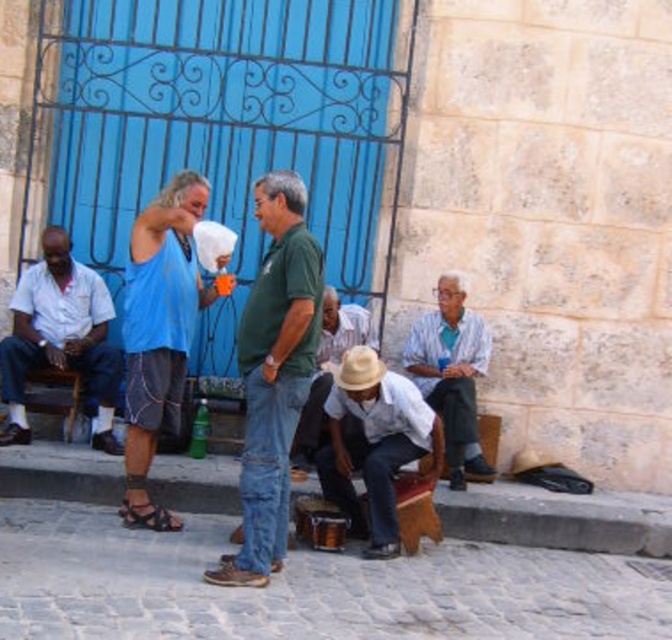
You are a photographer trying to capture a photo of the green matte shirt at center and the brown leather sandal at lower left. Since you want both subjects to be in focus, which one should you focus on first to ensure the other is also in focus?

The green matte shirt at center is taller than the brown leather sandal at lower left, so focusing on the green matte shirt at center first will ensure the brown leather sandal at lower left is also in focus due to its closer distance to the camera.

You are a photographer standing at the camera position in the scene. You want to take a photo of both point (204, 572) and point (60, 307). Which point will appear larger in your photo?

Point (204, 572) is closer to the camera than point (60, 307), so it will appear larger in the photo.